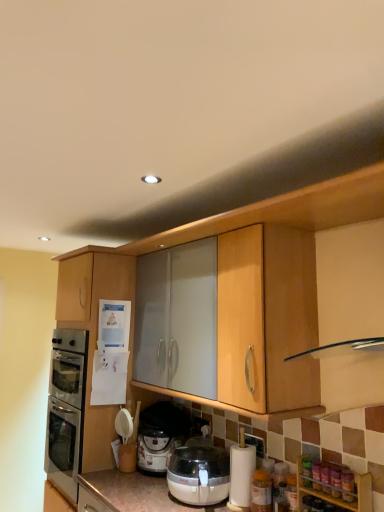
What do you see at coordinates (160, 435) in the screenshot?
I see `translucent plastic pressure cooker at lower center` at bounding box center [160, 435].

Describe the element at coordinates (332, 487) in the screenshot. I see `wooden spice rack at lower right, which is counted as the second cabinetry, starting from the left` at that location.

This screenshot has height=512, width=384. What do you see at coordinates (347, 485) in the screenshot?
I see `translucent plastic bottle at lower right, placed as the 1th bottle when sorted from top to bottom` at bounding box center [347, 485].

How much space does translucent plastic bottle at lower right, positioned as the first bottle in front-to-back order, occupy horizontally?

2.12 inches.

What do you see at coordinates (261, 490) in the screenshot? I see `translucent plastic bottle at lower right, which appears as the 2th bottle when viewed from the front` at bounding box center [261, 490].

At what (x,y) coordinates should I click in order to perform the action: click on translucent plastic pressure cooker at lower center. Please return your answer as a coordinate pair (x, y). The image size is (384, 512). Looking at the image, I should click on (160, 435).

Measure the distance from translucent plastic pressure cooker at lower center to translucent plastic bottle at lower right, arranged as the 2th bottle when viewed from the left.

translucent plastic pressure cooker at lower center is 1.03 meters from translucent plastic bottle at lower right, arranged as the 2th bottle when viewed from the left.

I want to click on pressure cooker below the translucent plastic bottle at lower right, the second bottle when ordered from bottom to top (from a real-world perspective), so click(160, 435).

Is translucent plastic pressure cooker at lower center located outside translucent plastic bottle at lower right, the 2th bottle positioned from the back?

translucent plastic pressure cooker at lower center is positioned outside translucent plastic bottle at lower right, the 2th bottle positioned from the back.

Is point (184, 435) in front of point (351, 474)?

No.

From the image's perspective, which one is positioned lower, wooden spice rack at lower right, the 1th cabinetry when ordered from right to left, or matte wood cabinet at left, the second cabinetry from the front?

wooden spice rack at lower right, the 1th cabinetry when ordered from right to left, is shown below in the image.

From a real-world perspective, is wooden spice rack at lower right, which is counted as the second cabinetry, starting from the left, physically below matte wood cabinet at left, the second cabinetry from the front?

Yes, from a real-world perspective, wooden spice rack at lower right, which is counted as the second cabinetry, starting from the left, is under matte wood cabinet at left, the second cabinetry from the front.

Are translucent plastic bottle at lower right, the second bottle when ordered from bottom to top, and wooden spice rack at lower right, which is the first cabinetry in bottom-to-top order, making contact?

→ Yes, translucent plastic bottle at lower right, the second bottle when ordered from bottom to top, and wooden spice rack at lower right, which is the first cabinetry in bottom-to-top order, clearly make contact.

Identify the location of cabinetry below the translucent plastic bottle at lower right, the 2th bottle positioned from the back (from a real-world perspective). (332, 487).

Could wooden spice rack at lower right, which appears as the second cabinetry when viewed from the back, be considered to be inside translucent plastic bottle at lower right, placed as the 1th bottle when sorted from top to bottom?

No, wooden spice rack at lower right, which appears as the second cabinetry when viewed from the back, is located outside of translucent plastic bottle at lower right, placed as the 1th bottle when sorted from top to bottom.

Who is shorter, translucent plastic bottle at lower right, placed as the 1th bottle when sorted from top to bottom, or wooden spice rack at lower right, which appears as the second cabinetry when viewed from the back?

translucent plastic bottle at lower right, placed as the 1th bottle when sorted from top to bottom, is shorter.

From the image's perspective, is matte wood cabinet at left, the second cabinetry from the right, located above or below translucent plastic pressure cooker at lower center?

Based on their image positions, matte wood cabinet at left, the second cabinetry from the right, is located above translucent plastic pressure cooker at lower center.

Considering the positions of objects matte wood cabinet at left, the 2th cabinetry in the bottom-to-top sequence, and translucent plastic pressure cooker at lower center in the image provided, who is more to the right, matte wood cabinet at left, the 2th cabinetry in the bottom-to-top sequence, or translucent plastic pressure cooker at lower center?

Positioned to the right is translucent plastic pressure cooker at lower center.

Can you confirm if matte wood cabinet at left, the second cabinetry from the right, is shorter than translucent plastic pressure cooker at lower center?

In fact, matte wood cabinet at left, the second cabinetry from the right, may be taller than translucent plastic pressure cooker at lower center.

Do you think matte wood cabinet at left, the second cabinetry from the front, is within translucent plastic pressure cooker at lower center, or outside of it?

Answer: matte wood cabinet at left, the second cabinetry from the front, is located beyond the bounds of translucent plastic pressure cooker at lower center.

Is matte wood cabinet at left, the second cabinetry from the right, aimed at translucent plastic bottle at lower right, the first bottle when ordered from bottom to top?

No.

Which object is further away from the camera taking this photo, matte wood cabinet at left, the 2th cabinetry in the bottom-to-top sequence, or translucent plastic bottle at lower right, positioned as the 2th bottle in top-to-bottom order?

matte wood cabinet at left, the 2th cabinetry in the bottom-to-top sequence, is more distant.

Can you tell me how much matte wood cabinet at left, the 2th cabinetry in the bottom-to-top sequence, and translucent plastic bottle at lower right, which appears as the 2th bottle when viewed from the front, differ in facing direction?

178 degrees separate the facing orientations of matte wood cabinet at left, the 2th cabinetry in the bottom-to-top sequence, and translucent plastic bottle at lower right, which appears as the 2th bottle when viewed from the front.

You are a GUI agent. You are given a task and a screenshot of the screen. Output one action in this format:
    pyautogui.click(x=<x>, y=<y>)
    Task: Click on the cabinetry on the left of translucent plastic bottle at lower right, which appears as the 2th bottle when viewed from the front
    The width and height of the screenshot is (384, 512).
    Given the screenshot: What is the action you would take?
    pyautogui.click(x=95, y=328)

Is wooden spice rack at lower right, which is the first cabinetry in bottom-to-top order, aimed at translucent plastic bottle at lower right, positioned as the 2th bottle in top-to-bottom order?

No, wooden spice rack at lower right, which is the first cabinetry in bottom-to-top order, does not turn towards translucent plastic bottle at lower right, positioned as the 2th bottle in top-to-bottom order.

How different are the orientations of wooden spice rack at lower right, the 1th cabinetry in the front-to-back sequence, and translucent plastic bottle at lower right, positioned as the 2th bottle in top-to-bottom order, in degrees?

1.18 degrees separate the facing orientations of wooden spice rack at lower right, the 1th cabinetry in the front-to-back sequence, and translucent plastic bottle at lower right, positioned as the 2th bottle in top-to-bottom order.

Considering the sizes of objects wooden spice rack at lower right, the 1th cabinetry in the front-to-back sequence, and translucent plastic bottle at lower right, the first bottle when ordered from bottom to top, in the image provided, who is wider, wooden spice rack at lower right, the 1th cabinetry in the front-to-back sequence, or translucent plastic bottle at lower right, the first bottle when ordered from bottom to top,?

Wider between the two is wooden spice rack at lower right, the 1th cabinetry in the front-to-back sequence.

Based on the photo, does wooden spice rack at lower right, which is the first cabinetry in bottom-to-top order, lie in front of translucent plastic bottle at lower right, which is the first bottle from left to right?

Yes, wooden spice rack at lower right, which is the first cabinetry in bottom-to-top order, is closer to the camera.

Consider the image. Is wooden spice rack at lower right, the 1th cabinetry when ordered from right to left, aimed at translucent plastic pressure cooker at lower center?

No, wooden spice rack at lower right, the 1th cabinetry when ordered from right to left, does not turn towards translucent plastic pressure cooker at lower center.

Is the position of wooden spice rack at lower right, which appears as the second cabinetry when viewed from the back, more distant than that of translucent plastic pressure cooker at lower center?

No, it is in front of translucent plastic pressure cooker at lower center.

You are a GUI agent. You are given a task and a screenshot of the screen. Output one action in this format:
    pyautogui.click(x=<x>, y=<y>)
    Task: Click on the pressure cooker on the left of the wooden spice rack at lower right, the 1th cabinetry in the front-to-back sequence
    This screenshot has width=384, height=512.
    Given the screenshot: What is the action you would take?
    pyautogui.click(x=160, y=435)

From the picture: Measure the distance from wooden spice rack at lower right, which is counted as the second cabinetry, starting from the left, to translucent plastic pressure cooker at lower center.

wooden spice rack at lower right, which is counted as the second cabinetry, starting from the left, is 33.29 inches away from translucent plastic pressure cooker at lower center.

Find the location of a particular element. This screenshot has width=384, height=512. bottle that is the 2nd object located in front of the translucent plastic pressure cooker at lower center is located at coordinates (347, 485).

Identify the location of cabinetry that is under the matte wood cabinet at left, the 2th cabinetry in the bottom-to-top sequence (from a real-world perspective). (332, 487).

Looking at the image, which one is located closer to translucent plastic bottle at lower right, the second bottle when ordered from bottom to top, translucent plastic pressure cooker at lower center or wooden spice rack at lower right, the 1th cabinetry when ordered from right to left?

Based on the image, wooden spice rack at lower right, the 1th cabinetry when ordered from right to left, appears to be nearer to translucent plastic bottle at lower right, the second bottle when ordered from bottom to top.

From the picture: Estimate the real-world distances between objects in this image. Which object is further from matte wood cabinet at left, the 2th cabinetry in the bottom-to-top sequence, translucent plastic bottle at lower right, which is the first bottle from left to right, or translucent plastic pressure cooker at lower center?

translucent plastic bottle at lower right, which is the first bottle from left to right.

Estimate the real-world distances between objects in this image. Which object is closer to translucent plastic bottle at lower right, the first bottle in the right-to-left sequence, matte wood cabinet at left, the second cabinetry from the front, or translucent plastic pressure cooker at lower center?

Based on the image, translucent plastic pressure cooker at lower center appears to be nearer to translucent plastic bottle at lower right, the first bottle in the right-to-left sequence.

Based on their spatial positions, is translucent plastic pressure cooker at lower center or wooden spice rack at lower right, placed as the second cabinetry when sorted from top to bottom, closer to translucent plastic bottle at lower right, which appears as the 2th bottle when viewed from the front?

Based on the image, wooden spice rack at lower right, placed as the second cabinetry when sorted from top to bottom, appears to be nearer to translucent plastic bottle at lower right, which appears as the 2th bottle when viewed from the front.

Which object lies further to the anchor point translucent plastic bottle at lower right, which is the first bottle from left to right, wooden spice rack at lower right, the 1th cabinetry when ordered from right to left, or translucent plastic pressure cooker at lower center?

translucent plastic pressure cooker at lower center is positioned further to the anchor translucent plastic bottle at lower right, which is the first bottle from left to right.

Which object lies further to the anchor point translucent plastic bottle at lower right, placed as the 1th bottle when sorted from top to bottom, translucent plastic pressure cooker at lower center or matte wood cabinet at left, the 1th cabinetry positioned from the top?

matte wood cabinet at left, the 1th cabinetry positioned from the top, is positioned further to the anchor translucent plastic bottle at lower right, placed as the 1th bottle when sorted from top to bottom.

Based on their spatial positions, is translucent plastic bottle at lower right, placed as the second bottle when sorted from right to left, or matte wood cabinet at left, the second cabinetry from the right, further from translucent plastic pressure cooker at lower center?

The object further to translucent plastic pressure cooker at lower center is translucent plastic bottle at lower right, placed as the second bottle when sorted from right to left.

When comparing their distances from matte wood cabinet at left, the 1th cabinetry viewed from the back, does translucent plastic pressure cooker at lower center or wooden spice rack at lower right, the 1th cabinetry in the front-to-back sequence, seem closer?

translucent plastic pressure cooker at lower center is closer to matte wood cabinet at left, the 1th cabinetry viewed from the back.

Locate an element on the screen. Image resolution: width=384 pixels, height=512 pixels. pressure cooker located between matte wood cabinet at left, the second cabinetry from the right, and wooden spice rack at lower right, the 1th cabinetry in the front-to-back sequence, in the left-right direction is located at coordinates (160, 435).

The image size is (384, 512). Find the location of `pressure cooker between matte wood cabinet at left, the second cabinetry from the front, and translucent plastic bottle at lower right, acting as the 1th bottle starting from the back, from left to right`. pressure cooker between matte wood cabinet at left, the second cabinetry from the front, and translucent plastic bottle at lower right, acting as the 1th bottle starting from the back, from left to right is located at coordinates (160, 435).

You are a GUI agent. You are given a task and a screenshot of the screen. Output one action in this format:
    pyautogui.click(x=<x>, y=<y>)
    Task: Click on the cabinetry between translucent plastic bottle at lower right, which appears as the 2th bottle when viewed from the front, and translucent plastic bottle at lower right, the 2th bottle positioned from the back, from left to right
    The height and width of the screenshot is (512, 384).
    Given the screenshot: What is the action you would take?
    pyautogui.click(x=332, y=487)

The image size is (384, 512). In order to click on bottle between matte wood cabinet at left, the 2th cabinetry in the bottom-to-top sequence, and wooden spice rack at lower right, which is the first cabinetry in bottom-to-top order, from left to right in this screenshot , I will do `click(261, 490)`.